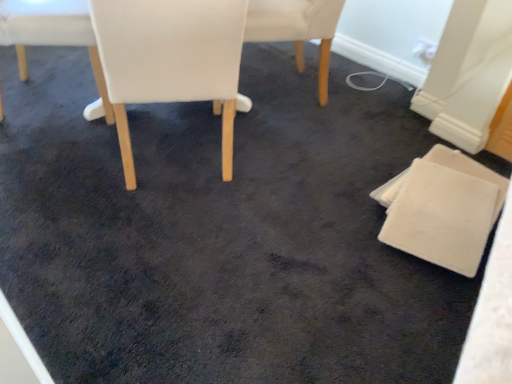
Question: Is white fabric chair at upper left, acting as the 4th chair starting from the right, with white leather chair at center, the 2th chair viewed from the left?

Choices:
 (A) no
 (B) yes

Answer: (A)

Question: From a real-world perspective, is white fabric chair at upper left, acting as the 4th chair starting from the right, physically below white leather chair at center, arranged as the third chair when viewed from the right?

Choices:
 (A) no
 (B) yes

Answer: (B)

Question: Is white fabric chair at upper left, acting as the 4th chair starting from the right, aimed at white leather chair at center, arranged as the third chair when viewed from the right?

Choices:
 (A) yes
 (B) no

Answer: (B)

Question: Considering the relative sizes of white fabric chair at upper left, acting as the 4th chair starting from the right, and white leather chair at center, arranged as the third chair when viewed from the right, in the image provided, is white fabric chair at upper left, acting as the 4th chair starting from the right, thinner than white leather chair at center, arranged as the third chair when viewed from the right,?

Choices:
 (A) yes
 (B) no

Answer: (A)

Question: Can you confirm if white fabric chair at upper left, acting as the 4th chair starting from the right, is taller than white leather chair at center, arranged as the third chair when viewed from the right?

Choices:
 (A) yes
 (B) no

Answer: (B)

Question: Considering the relative positions of white fabric chair at upper left, placed as the 1th chair when sorted from left to right, and white leather chair at center, arranged as the third chair when viewed from the right, in the image provided, is white fabric chair at upper left, placed as the 1th chair when sorted from left to right, behind white leather chair at center, arranged as the third chair when viewed from the right,?

Choices:
 (A) no
 (B) yes

Answer: (B)

Question: Can you confirm if white leather chair at center, the 2th chair viewed from the left, is smaller than white felt coaster at lower right, which appears as the fourth chair when viewed from the left?

Choices:
 (A) yes
 (B) no

Answer: (B)

Question: Can you confirm if white leather chair at center, the 2th chair viewed from the left, is wider than white felt coaster at lower right, which appears as the fourth chair when viewed from the left?

Choices:
 (A) yes
 (B) no

Answer: (A)

Question: Considering the relative positions of white leather chair at center, the 2th chair viewed from the left, and white felt coaster at lower right, which appears as the fourth chair when viewed from the left, in the image provided, is white leather chair at center, the 2th chair viewed from the left, to the right of white felt coaster at lower right, which appears as the fourth chair when viewed from the left, from the viewer's perspective?

Choices:
 (A) yes
 (B) no

Answer: (B)

Question: Is the depth of white leather chair at center, arranged as the third chair when viewed from the right, greater than that of white felt coaster at lower right, placed as the 1th chair when sorted from right to left?

Choices:
 (A) no
 (B) yes

Answer: (A)

Question: From the image's perspective, does white leather chair at center, the 2th chair viewed from the left, appear lower than white felt coaster at lower right, placed as the 1th chair when sorted from right to left?

Choices:
 (A) no
 (B) yes

Answer: (A)

Question: Is white leather chair at center, the 2th chair viewed from the left, oriented away from white felt coaster at lower right, placed as the 1th chair when sorted from right to left?

Choices:
 (A) no
 (B) yes

Answer: (A)

Question: Is white leather chair at center, marked as the 2th chair in a right-to-left arrangement, facing away from white leather chair at center, the 2th chair viewed from the left?

Choices:
 (A) yes
 (B) no

Answer: (B)